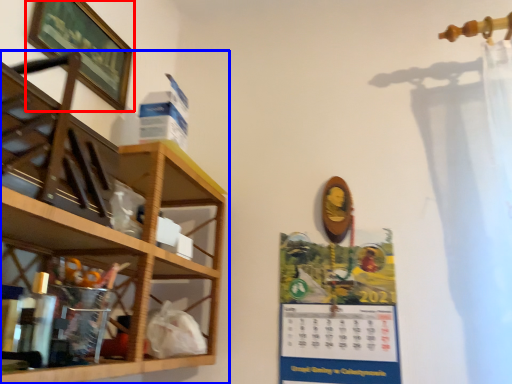
Question: Which point is closer to the camera, picture frame (highlighted by a red box) or shelf (highlighted by a blue box)?

Choices:
 (A) picture frame
 (B) shelf

Answer: (B)